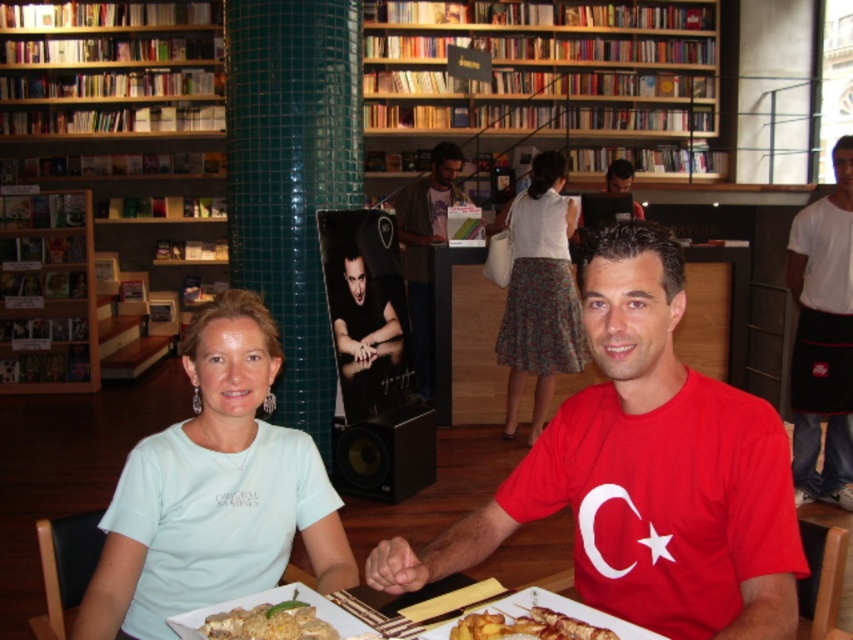
You are a customer in the bookstore cafe and want to take a photo of the golden crispy fries at lower center without the white textured skirt at center blocking the view. Is it possible to do so?

The golden crispy fries at lower center is behind the white textured skirt at center, so it is blocked by the skirt and cannot be seen without moving the skirt.